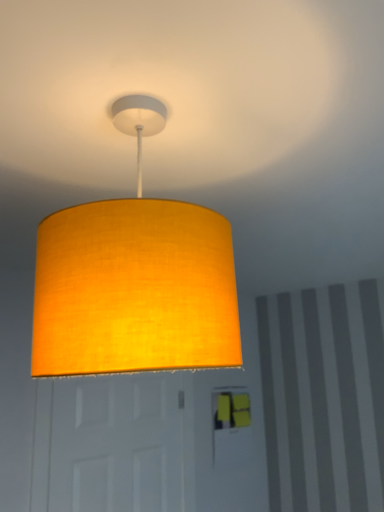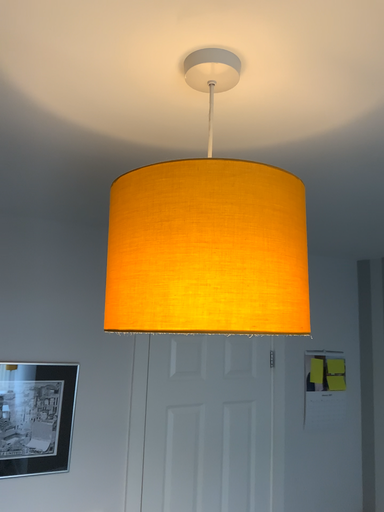
Question: How did the camera likely rotate when shooting the video?

Choices:
 (A) rotated right
 (B) rotated left

Answer: (B)